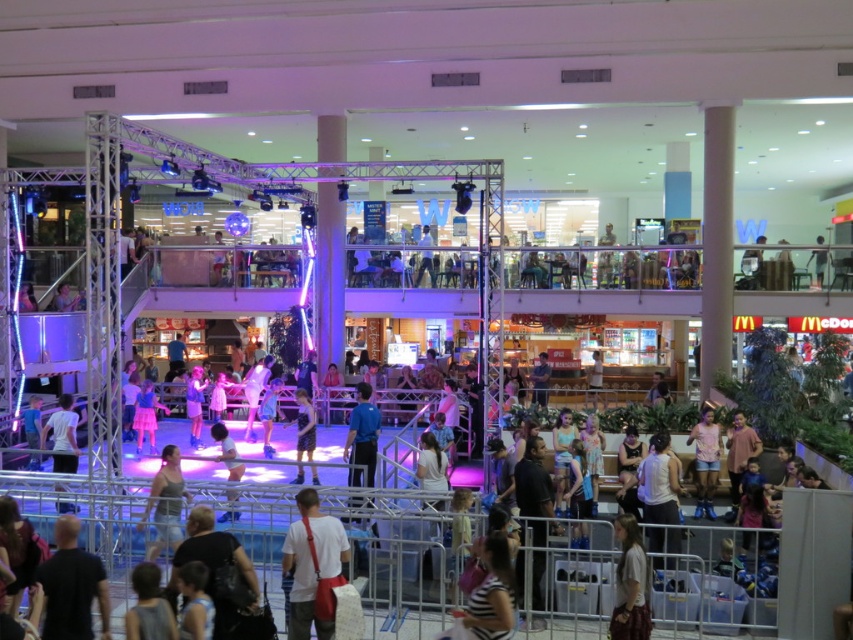
Is black matte shirt at lower left to the left of pink cotton shirt at center from the viewer's perspective?

Indeed, black matte shirt at lower left is positioned on the left side of pink cotton shirt at center.

Is black matte shirt at lower left thinner than pink cotton shirt at center?

Yes.

Who is more forward, (79, 572) or (701, 470)?

Point (79, 572)

Locate an element on the screen. This screenshot has width=853, height=640. black matte shirt at lower left is located at coordinates (73, 586).

Measure the distance from dark gray fabric backpack at lower center to light brown fabric dress at lower right.

A distance of 11.20 feet exists between dark gray fabric backpack at lower center and light brown fabric dress at lower right.

You are a GUI agent. You are given a task and a screenshot of the screen. Output one action in this format:
    pyautogui.click(x=<x>, y=<y>)
    Task: Click on the dark gray fabric backpack at lower center
    This screenshot has height=640, width=853.
    Given the screenshot: What is the action you would take?
    pyautogui.click(x=219, y=573)

The height and width of the screenshot is (640, 853). What do you see at coordinates (219, 573) in the screenshot?
I see `dark gray fabric backpack at lower center` at bounding box center [219, 573].

The height and width of the screenshot is (640, 853). Find the location of `dark gray fabric backpack at lower center`. dark gray fabric backpack at lower center is located at coordinates click(x=219, y=573).

Between black matte shirt at lower left and blue fabric shirt at center, which one has more height?

With more height is blue fabric shirt at center.

In order to click on black matte shirt at lower left in this screenshot , I will do coord(73,586).

This screenshot has width=853, height=640. I want to click on black matte shirt at lower left, so click(73, 586).